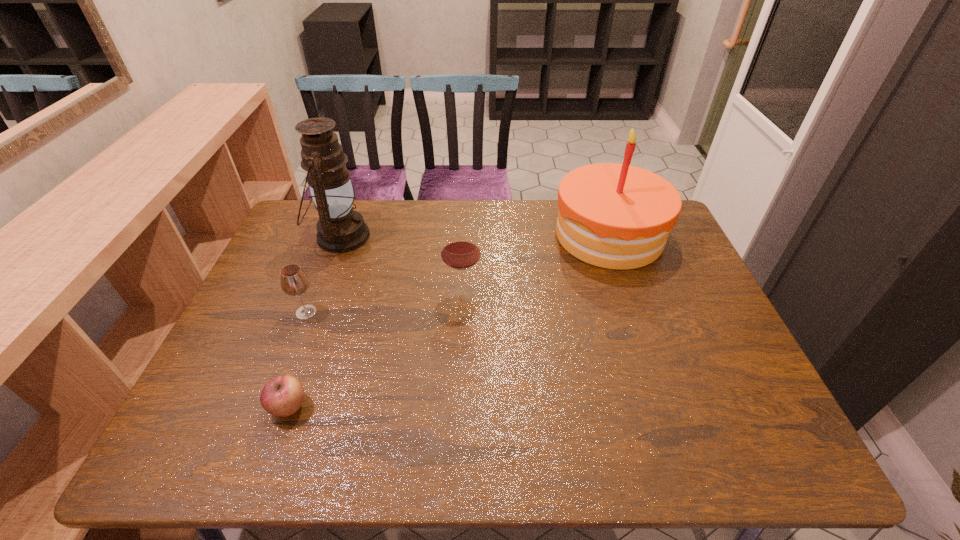
Image resolution: width=960 pixels, height=540 pixels. Find the location of `oil lamp`. oil lamp is located at coordinates (340, 229).

You are a GUI agent. You are given a task and a screenshot of the screen. Output one action in this format:
    pyautogui.click(x=<x>, y=<y>)
    Task: Click on the birthday cake
    Image resolution: width=960 pixels, height=540 pixels.
    Given the screenshot: What is the action you would take?
    pyautogui.click(x=616, y=216)

Locate an element on the screen. the right wineglass is located at coordinates (460, 250).

Locate an element on the screen. The height and width of the screenshot is (540, 960). the second object from right to left is located at coordinates (460, 250).

I want to click on the second shortest object, so click(x=294, y=281).

The height and width of the screenshot is (540, 960). Identify the location of the left wineglass. (294, 281).

Find the location of a particular element. This screenshot has height=540, width=960. the shortest object is located at coordinates (282, 396).

Where is `the nearest object`? the nearest object is located at coordinates (282, 396).

At what (x,y) coordinates should I click in order to perform the action: click on vacant space situated on the front of the oil lamp. Please return your answer as a coordinate pair (x, y). The height and width of the screenshot is (540, 960). Looking at the image, I should click on (300, 345).

Locate an element on the screen. vacant space situated 0.370m on the left of the rightmost object is located at coordinates (439, 235).